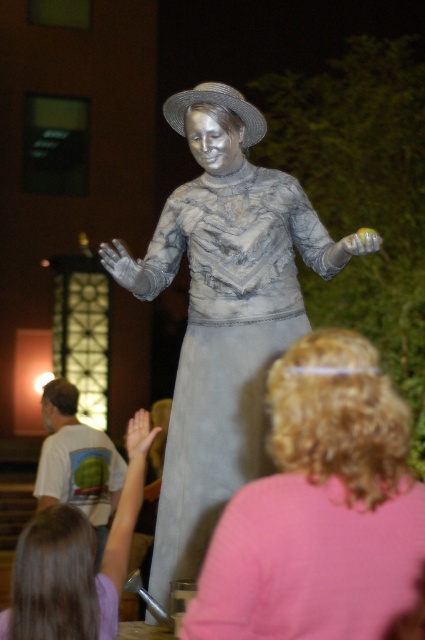
Is silver/statue at center smaller than matte silver statue at center?

No, silver/statue at center is not smaller than matte silver statue at center.

Who is more distant from viewer, (354,236) or (37,525)?

Positioned behind is point (354,236).

I want to click on silver/statue at center, so click(x=223, y=310).

Does point (354, 451) lie in front of point (74, 397)?

Yes, it is in front of point (74, 397).

Who is shorter, blonde curly hair at center or matte gray statue at center?

blonde curly hair at center is shorter.

Is point (356, 563) positioned behind point (54, 477)?

No, (356, 563) is closer to viewer.

At what (x,y) coordinates should I click in order to perform the action: click on blonde curly hair at center. Please return your answer as a coordinate pair (x, y). This screenshot has height=640, width=425. Looking at the image, I should click on (319, 508).

Is silver/statue at center to the right of blonde curly hair at center from the viewer's perspective?

In fact, silver/statue at center is to the left of blonde curly hair at center.

Between silver/statue at center and blonde curly hair at center, which one has more height?

Standing taller between the two is silver/statue at center.

Is point (314, 268) farther from camera compared to point (405, 419)?

Yes, it is.

You are a GUI agent. You are given a task and a screenshot of the screen. Output one action in this format:
    pyautogui.click(x=<x>, y=<y>)
    Task: Click on the silver/statue at center
    
    Given the screenshot: What is the action you would take?
    pyautogui.click(x=223, y=310)